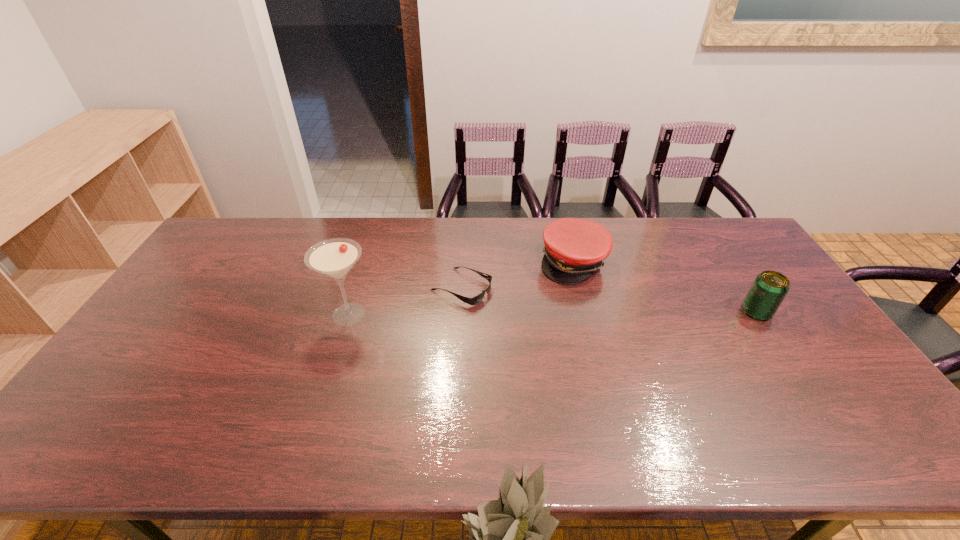
Identify the location of vacant space situated 0.370m on the front-facing side of the shortest object. The height and width of the screenshot is (540, 960). (602, 348).

Where is `free space located on the front-facing side of the second object from right to left`? free space located on the front-facing side of the second object from right to left is located at coordinates 595,295.

Find the location of a particular element. This screenshot has width=960, height=540. blank space located 0.230m on the front-facing side of the second object from right to left is located at coordinates (622, 338).

Where is `free space located 0.050m on the front-facing side of the second object from right to left`? The image size is (960, 540). free space located 0.050m on the front-facing side of the second object from right to left is located at coordinates (595, 295).

Locate an element on the screen. This screenshot has height=540, width=960. object that is at the far edge is located at coordinates (574, 248).

Locate an element on the screen. object that is at the right edge is located at coordinates (769, 288).

The width and height of the screenshot is (960, 540). In the image, there is a desktop. In order to click on vacant space at the far edge in this screenshot , I will do `click(447, 218)`.

You are a GUI agent. You are given a task and a screenshot of the screen. Output one action in this format:
    pyautogui.click(x=<x>, y=<y>)
    Task: Click on the free space at the near edge of the desktop
    The height and width of the screenshot is (540, 960).
    Given the screenshot: What is the action you would take?
    pyautogui.click(x=490, y=413)

Image resolution: width=960 pixels, height=540 pixels. I want to click on vacant area at the left edge of the desktop, so click(170, 367).

In order to click on vacant space at the far left corner of the desktop in this screenshot , I will do `click(245, 228)`.